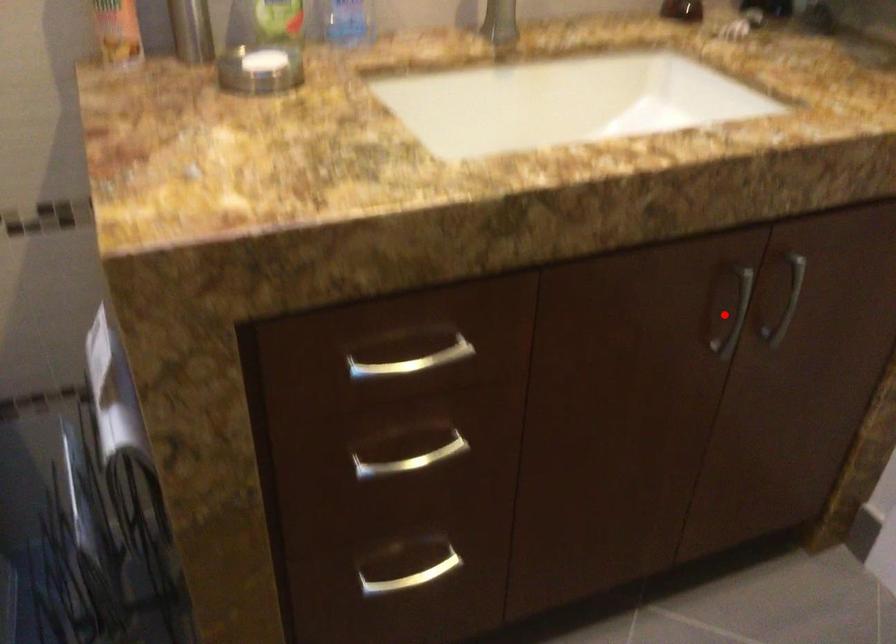
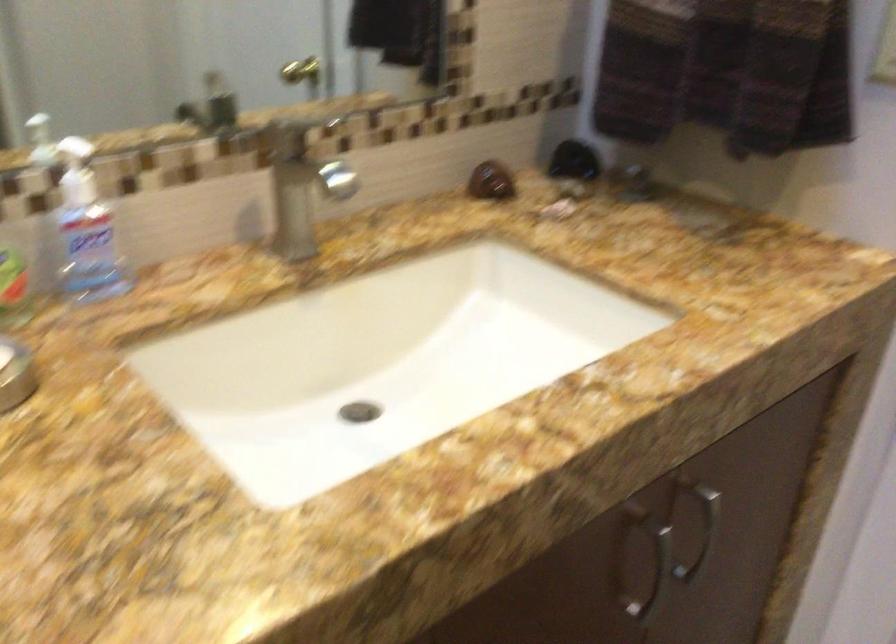
Question: I am providing you with two images of the same scene from different viewpoints. In image1, a red point is highlighted. Considering the same 3D point in image2, which of the following is correct?

Choices:
 (A) It is closer
 (B) It is farther

Answer: (A)